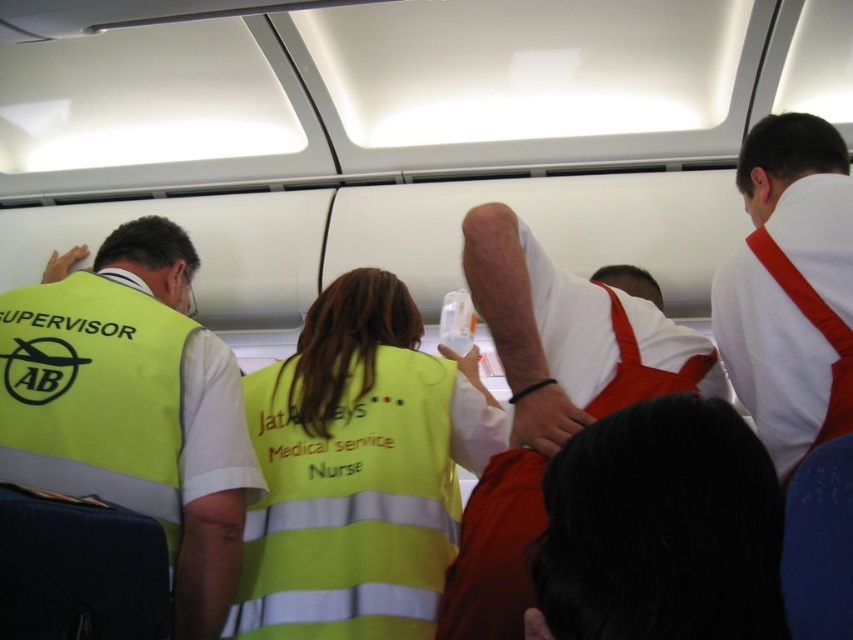
Question: Does high visibility yellow vest at center appear under yellow reflective vest at left?

Choices:
 (A) no
 (B) yes

Answer: (B)

Question: Considering the real-world distances, which object is closest to the yellow reflective vest at left?

Choices:
 (A) white cotton shirt at upper center
 (B) high visibility yellow vest at center

Answer: (B)

Question: Does high visibility yellow vest at center have a smaller size compared to white cotton shirt at upper center?

Choices:
 (A) yes
 (B) no

Answer: (A)

Question: From the image, what is the correct spatial relationship of high visibility yellow vest at center in relation to white cotton shirt at upper center?

Choices:
 (A) below
 (B) above

Answer: (A)

Question: Which point is closer to the camera taking this photo?

Choices:
 (A) (497, 572)
 (B) (814, 401)

Answer: (A)

Question: Which of the following is the farthest from the observer?

Choices:
 (A) yellow reflective vest at left
 (B) high visibility yellow vest at center

Answer: (B)